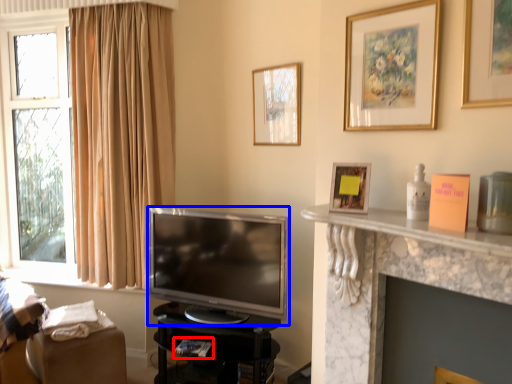
Question: Which object appears farthest to the camera in this image, book (highlighted by a red box) or television (highlighted by a blue box)?

Choices:
 (A) book
 (B) television

Answer: (A)